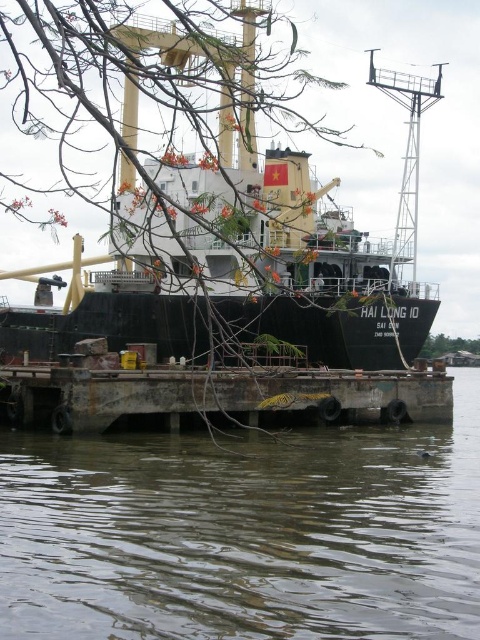
Question: Which of these objects is positioned closest to the green leafy tree at lower right?

Choices:
 (A) rusty metal dock at lower center
 (B) transparent water at lower center
 (C) black matte ship at center

Answer: (A)

Question: Among these points, which one is nearest to the camera?

Choices:
 (A) (442, 353)
 (B) (87, 573)
 (C) (60, 376)
 (D) (262, 250)

Answer: (B)

Question: Can you confirm if rusty metal dock at lower center is bigger than green leafy tree at lower right?

Choices:
 (A) no
 (B) yes

Answer: (B)

Question: Is black matte ship at center wider than rusty metal dock at lower center?

Choices:
 (A) yes
 (B) no

Answer: (A)

Question: Which point appears farthest from the camera in this image?

Choices:
 (A) (364, 490)
 (B) (440, 412)
 (C) (153, 278)

Answer: (C)

Question: Where is black matte ship at center located in relation to rusty metal dock at lower center in the image?

Choices:
 (A) right
 (B) left

Answer: (B)